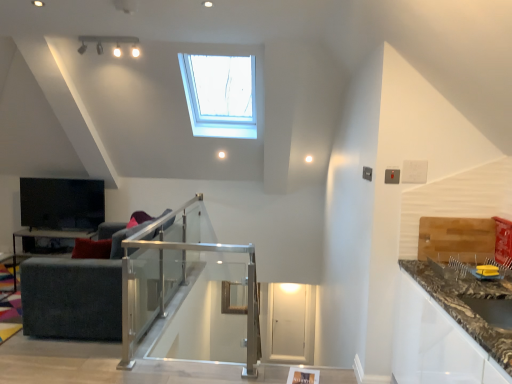
Question: Considering the relative sizes of marble-patterned countertop at lower right and dark gray fabric couch at left in the image provided, is marble-patterned countertop at lower right taller than dark gray fabric couch at left?

Choices:
 (A) yes
 (B) no

Answer: (B)

Question: From the image's perspective, is marble-patterned countertop at lower right beneath dark gray fabric couch at left?

Choices:
 (A) yes
 (B) no

Answer: (A)

Question: Is marble-patterned countertop at lower right to the right of dark gray fabric couch at left from the viewer's perspective?

Choices:
 (A) yes
 (B) no

Answer: (A)

Question: Can you confirm if marble-patterned countertop at lower right is positioned to the left of dark gray fabric couch at left?

Choices:
 (A) yes
 (B) no

Answer: (B)

Question: From a real-world perspective, is marble-patterned countertop at lower right on dark gray fabric couch at left?

Choices:
 (A) no
 (B) yes

Answer: (B)

Question: Is marble-patterned countertop at lower right shorter than dark gray fabric couch at left?

Choices:
 (A) yes
 (B) no

Answer: (A)

Question: Does marble-patterned countertop at lower right turn towards clear glass balustrade at center?

Choices:
 (A) no
 (B) yes

Answer: (B)

Question: Does marble-patterned countertop at lower right have a smaller size compared to clear glass balustrade at center?

Choices:
 (A) yes
 (B) no

Answer: (B)

Question: Is marble-patterned countertop at lower right not close to clear glass balustrade at center?

Choices:
 (A) no
 (B) yes

Answer: (B)

Question: From a real-world perspective, is marble-patterned countertop at lower right physically above clear glass balustrade at center?

Choices:
 (A) no
 (B) yes

Answer: (B)

Question: Can you confirm if marble-patterned countertop at lower right is positioned to the left of clear glass balustrade at center?

Choices:
 (A) no
 (B) yes

Answer: (A)

Question: From the image's perspective, is marble-patterned countertop at lower right under clear glass balustrade at center?

Choices:
 (A) no
 (B) yes

Answer: (B)

Question: Is clear glass balustrade at center far away from dark gray fabric couch at left?

Choices:
 (A) yes
 (B) no

Answer: (B)